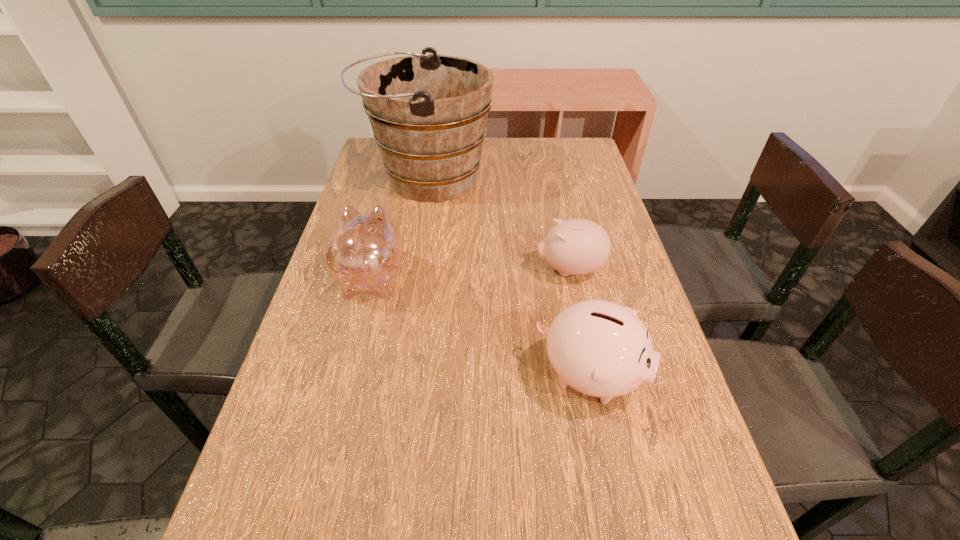
Where is `piggy bank that is the closest one to the shortest piggy bank`? This screenshot has width=960, height=540. piggy bank that is the closest one to the shortest piggy bank is located at coordinates (602, 349).